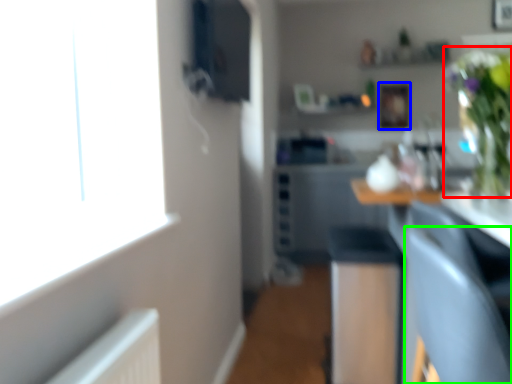
Question: Based on their relative distances, which object is farther from floral arrangement (highlighted by a red box)? Choose from picture frame (highlighted by a blue box) and armchair (highlighted by a green box).

Choices:
 (A) picture frame
 (B) armchair

Answer: (A)